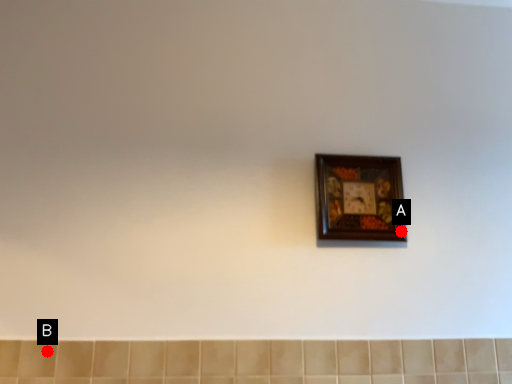
Question: Two points are circled on the image, labeled by A and B beside each circle. Which point appears farthest from the camera in this image?

Choices:
 (A) A is further
 (B) B is further

Answer: (A)